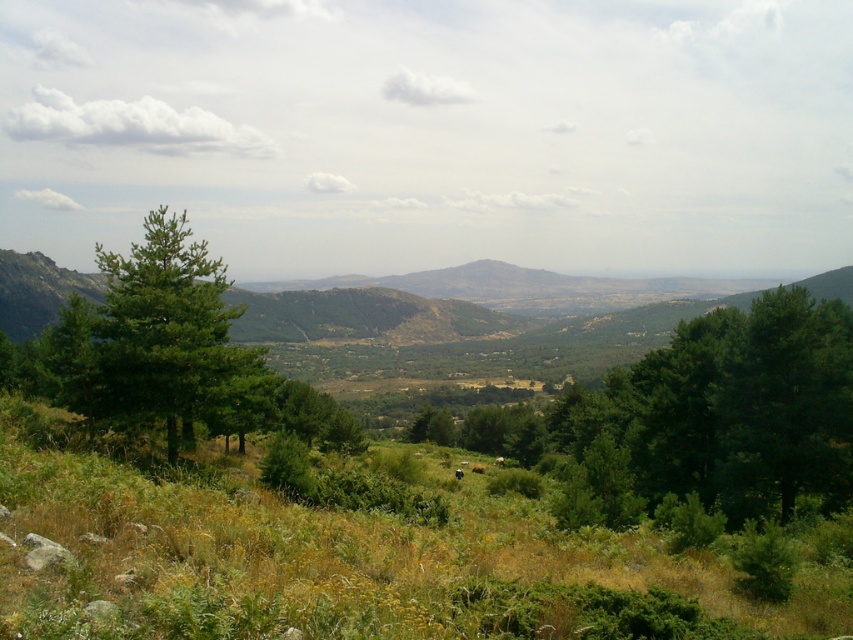
Question: Among these points, which one is nearest to the camera?

Choices:
 (A) (735, 364)
 (B) (460, 476)

Answer: (A)

Question: Is green grassy field at center behind brown furry animal at center?

Choices:
 (A) no
 (B) yes

Answer: (A)

Question: Which point is farther to the camera?

Choices:
 (A) (462, 476)
 (B) (480, 468)
 (C) (201, 525)
 (D) (149, 252)

Answer: (B)

Question: Is green grassy field at center to the right of brown furry cow at center from the viewer's perspective?

Choices:
 (A) no
 (B) yes

Answer: (A)

Question: Does green leafy tree at right have a smaller size compared to brown furry cow at center?

Choices:
 (A) yes
 (B) no

Answer: (B)

Question: Among these objects, which one is farthest from the camera?

Choices:
 (A) green leafy tree at right
 (B) brown furry cow at center
 (C) brown furry animal at center

Answer: (B)